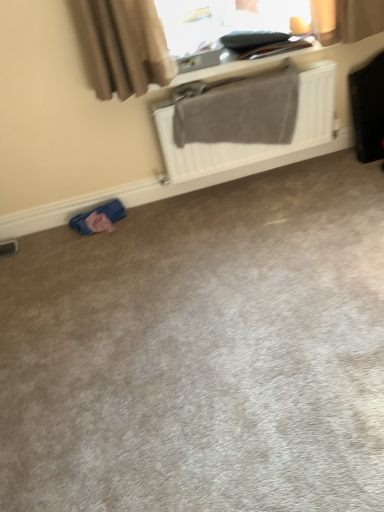
Question: Is blue fabric at lower left with white matte radiator at upper center?

Choices:
 (A) no
 (B) yes

Answer: (A)

Question: Does blue fabric at lower left have a smaller size compared to white matte radiator at upper center?

Choices:
 (A) yes
 (B) no

Answer: (A)

Question: Is blue fabric at lower left thinner than white matte radiator at upper center?

Choices:
 (A) no
 (B) yes

Answer: (A)

Question: Can you confirm if blue fabric at lower left is shorter than white matte radiator at upper center?

Choices:
 (A) yes
 (B) no

Answer: (A)

Question: Is blue fabric at lower left outside of white matte radiator at upper center?

Choices:
 (A) no
 (B) yes

Answer: (B)

Question: In terms of width, does black leather suitcase at right look wider or thinner when compared to blue fabric at lower left?

Choices:
 (A) thin
 (B) wide

Answer: (B)

Question: Relative to blue fabric at lower left, is black leather suitcase at right in front or behind?

Choices:
 (A) front
 (B) behind

Answer: (A)

Question: Based on their sizes in the image, would you say black leather suitcase at right is bigger or smaller than blue fabric at lower left?

Choices:
 (A) small
 (B) big

Answer: (B)

Question: Is point (357, 104) positioned closer to the camera than point (110, 205)?

Choices:
 (A) farther
 (B) closer

Answer: (B)

Question: Is blue fabric at lower left inside or outside of black leather suitcase at right?

Choices:
 (A) outside
 (B) inside

Answer: (A)

Question: From the image's perspective, is blue fabric at lower left located above or below black leather suitcase at right?

Choices:
 (A) below
 (B) above

Answer: (A)

Question: Considering the positions of blue fabric at lower left and black leather suitcase at right in the image, is blue fabric at lower left bigger or smaller than black leather suitcase at right?

Choices:
 (A) big
 (B) small

Answer: (B)

Question: From their relative heights in the image, would you say blue fabric at lower left is taller or shorter than black leather suitcase at right?

Choices:
 (A) tall
 (B) short

Answer: (B)

Question: From the image's perspective, is black leather suitcase at right located above or below white matte radiator at upper center?

Choices:
 (A) above
 (B) below

Answer: (A)

Question: In terms of width, does black leather suitcase at right look wider or thinner when compared to white matte radiator at upper center?

Choices:
 (A) thin
 (B) wide

Answer: (B)